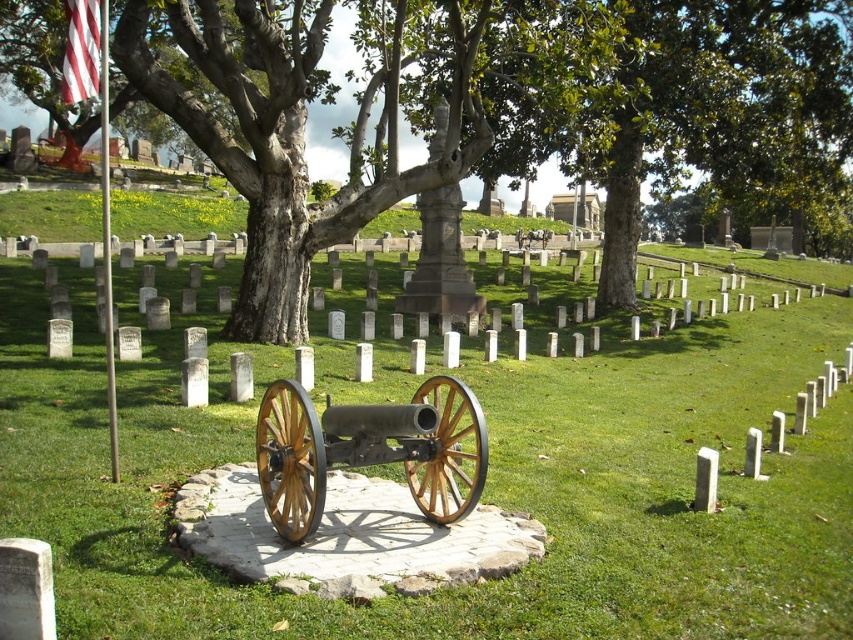
You are standing in the cemetery and want to take a photo of the wooden cannon at center without any obstructions. Since the green rough bark tree at center is in the way, which object should you move to get a clear view?

The wooden cannon at center is behind the green rough bark tree at center, so you should move the green rough bark tree at center to get a clear view of the wooden cannon at center.

You are standing in the cemetery and want to take a photo of both the green rough bark tree at center and the wooden cannon at center. Which object will appear larger in the photo?

The green rough bark tree at center will appear larger in the photo because it is much taller than the wooden cannon at center.